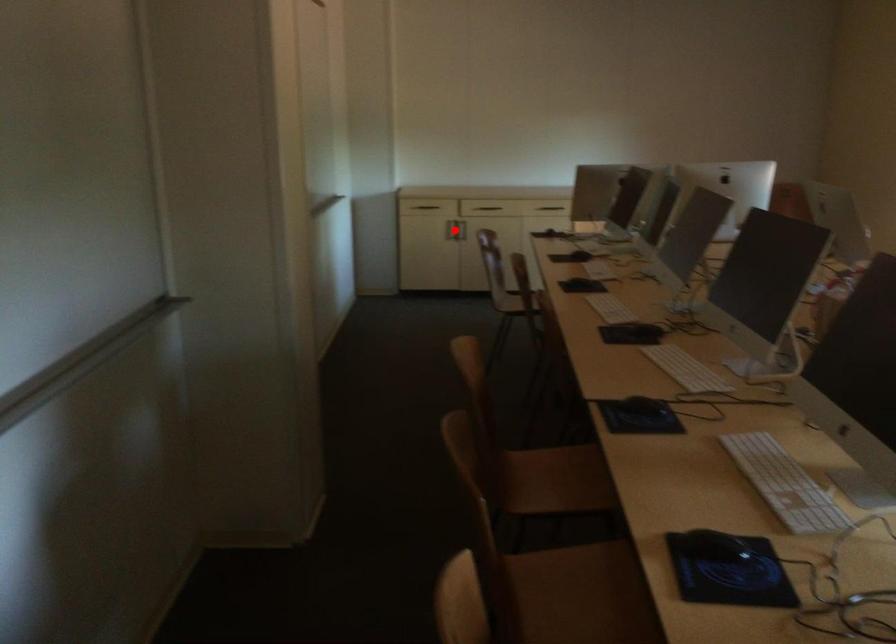
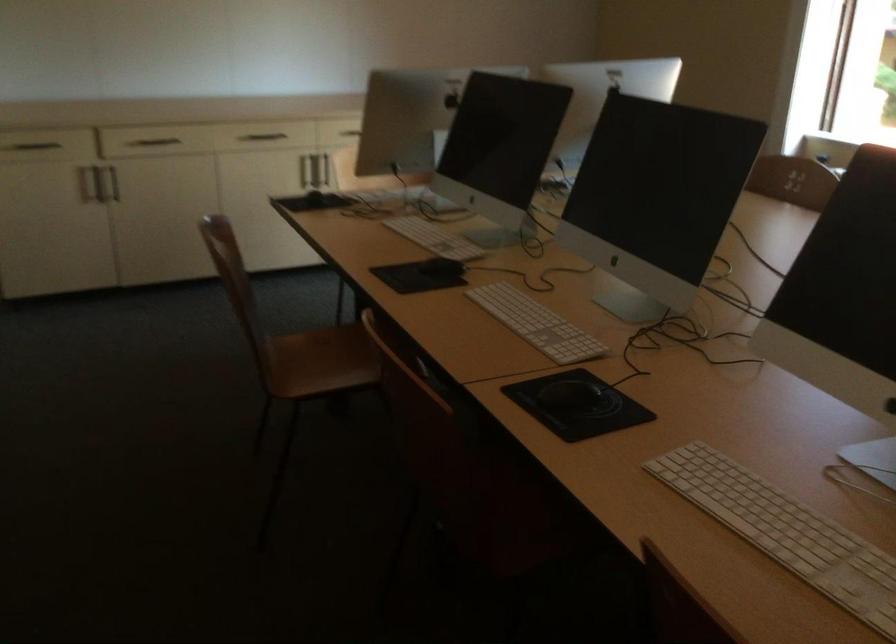
Question: I am providing you with two images of the same scene from different viewpoints. A red point is marked on the first image. Is the red point's position out of view in image 2?

Choices:
 (A) Yes
 (B) No

Answer: (A)